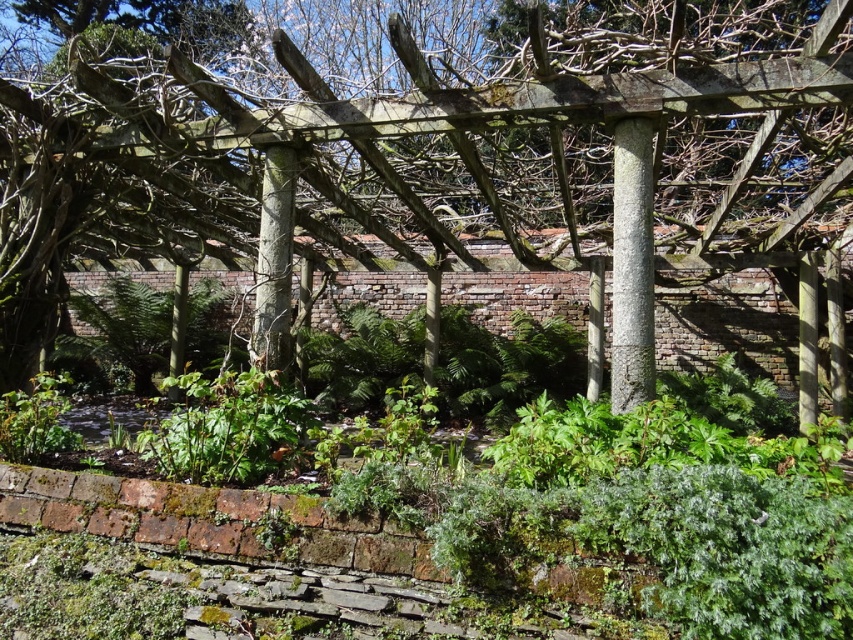
Question: Is smooth bark tree at center to the right of gray rough stone column at center from the viewer's perspective?

Choices:
 (A) no
 (B) yes

Answer: (A)

Question: Is smooth bark tree at center thinner than gray rough stone column at center?

Choices:
 (A) yes
 (B) no

Answer: (B)

Question: Which point is closer to the camera?

Choices:
 (A) smooth bark tree at center
 (B) gray rough stone column at center

Answer: (B)

Question: Is smooth bark tree at center thinner than gray rough stone column at center?

Choices:
 (A) no
 (B) yes

Answer: (A)